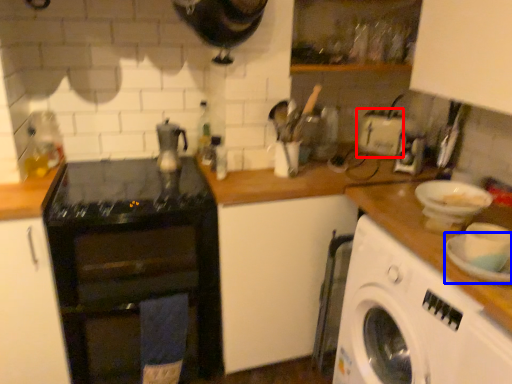
Question: Among these objects, which one is farthest to the camera, appliance (highlighted by a red box) or plate (highlighted by a blue box)?

Choices:
 (A) appliance
 (B) plate

Answer: (A)